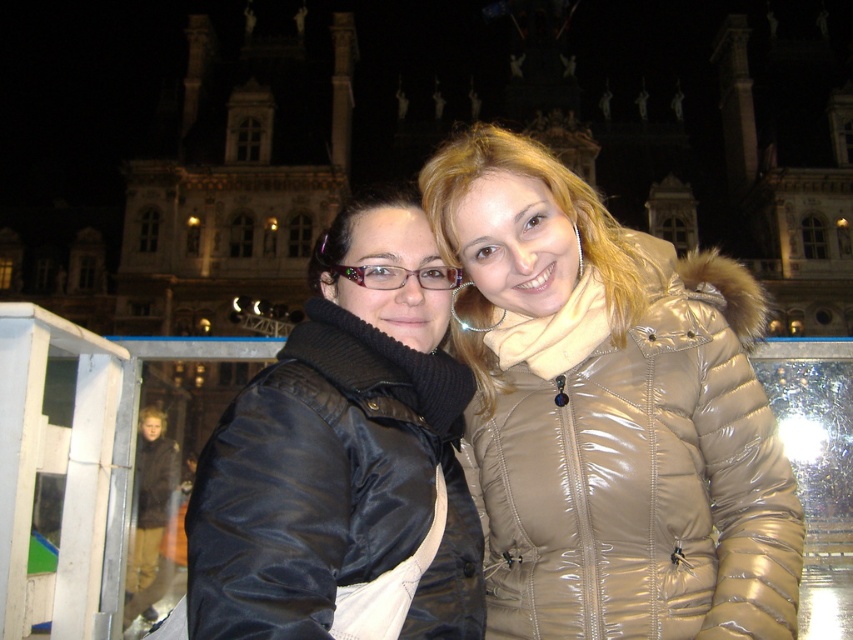
You are standing in front of the grand building at night. You see a point marked at coordinates (610, 413). Which object is located at that point?

The point at (610, 413) indicates the shiny beige coat at center.

You are a photographer who wants to take a photo of both the shiny beige coat at center and the black satin jacket at center. Since they are both at the center, how can you ensure both are fully visible in the photo?

The black satin jacket at center is behind the shiny beige coat at center, so you should position the camera so that the shiny beige coat at center is slightly moved forward to avoid blocking the black satin jacket at center.